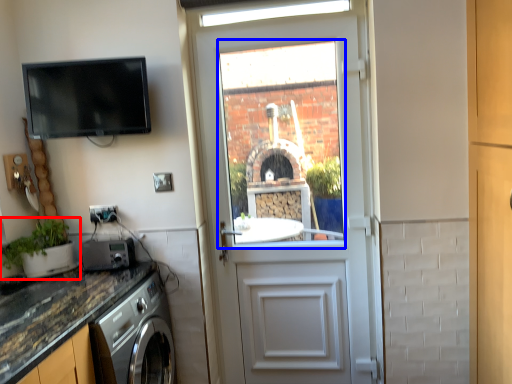
Question: Among these objects, which one is farthest to the camera, houseplant (highlighted by a red box) or window (highlighted by a blue box)?

Choices:
 (A) houseplant
 (B) window

Answer: (B)